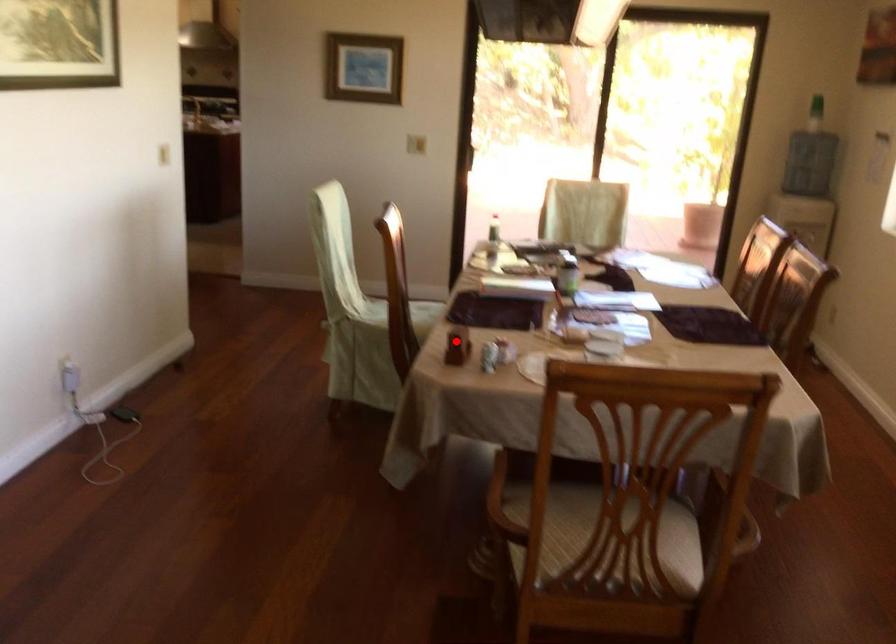
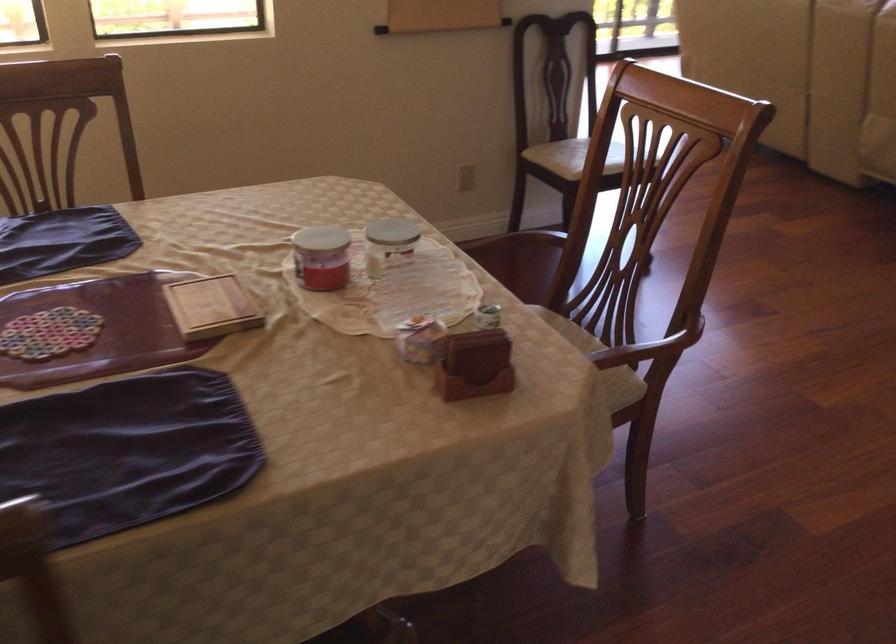
Locate, in the second image, the point that corresponds to the highlighted location in the first image.

(475, 365)